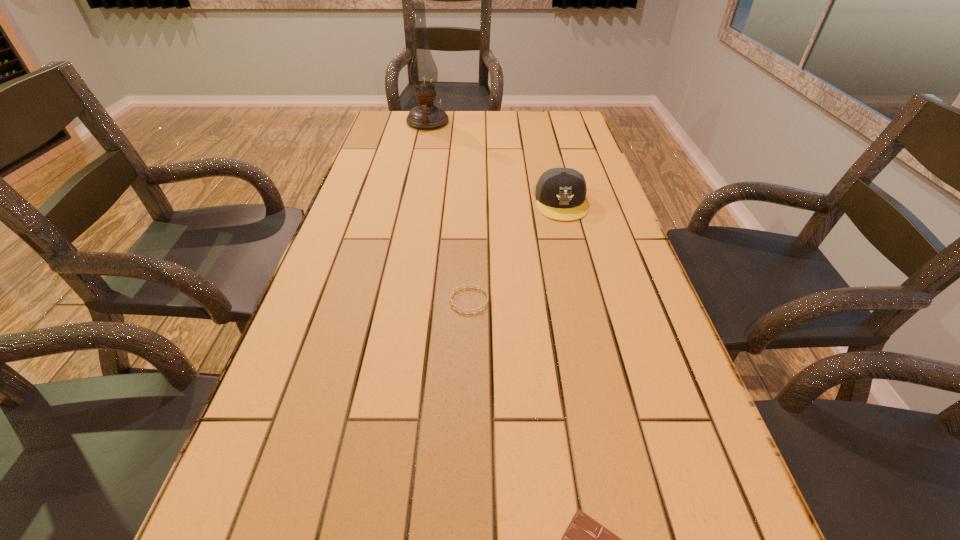
I want to click on vacant area that lies between the tallest object and the second farthest object, so click(494, 163).

Select which object is the second closest to the second nearest object. Please provide its 2D coordinates. Your answer should be formatted as a tuple, i.e. [(x, y)], where the tuple contains the x and y coordinates of a point satisfying the conditions above.

[(585, 539)]

Find the location of a particular element. object that stands as the third closest to the shortest object is located at coordinates (423, 71).

At what (x,y) coordinates should I click in order to perform the action: click on vacant space that satisfies the following two spatial constraints: 1. on the front-facing side of the second tallest object; 2. on the surface of the second shortest object showing star-shaped elements. Please return your answer as a coordinate pair (x, y). This screenshot has width=960, height=540. Looking at the image, I should click on (586, 301).

This screenshot has height=540, width=960. Identify the location of vacant position in the image that satisfies the following two spatial constraints: 1. on the front-facing side of the second farthest object; 2. on the surface of the third tallest object showing star-shaped elements. (586, 301).